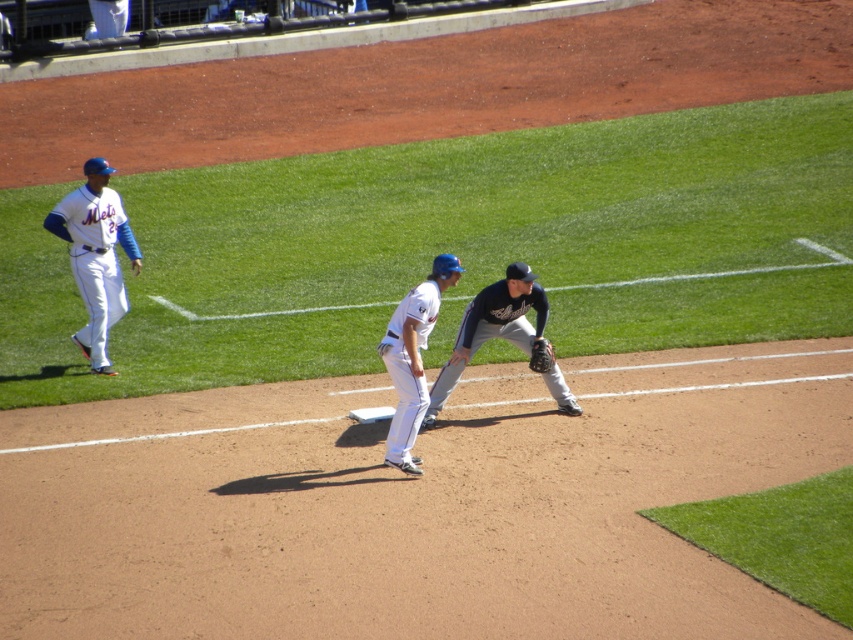
Question: Which point is farther to the camera?

Choices:
 (A) (569, 394)
 (B) (61, 218)
 (C) (529, 360)
 (D) (419, 372)

Answer: (B)

Question: Considering the real-world distances, which object is farthest from the dark brown leather glove at lower center?

Choices:
 (A) white uniformed player at left
 (B) dark gray uniform at center
 (C) white uniform at center

Answer: (A)

Question: Is dark gray uniform at center closer to the viewer compared to white uniform at center?

Choices:
 (A) yes
 (B) no

Answer: (B)

Question: Can you confirm if dark gray uniform at center is thinner than dark brown leather glove at lower center?

Choices:
 (A) no
 (B) yes

Answer: (A)

Question: Is dark gray uniform at center to the right of dark brown leather glove at lower center from the viewer's perspective?

Choices:
 (A) yes
 (B) no

Answer: (B)

Question: Which of the following is the closest to the observer?

Choices:
 (A) (421, 324)
 (B) (544, 365)
 (C) (490, 333)
 (D) (123, 209)

Answer: (A)